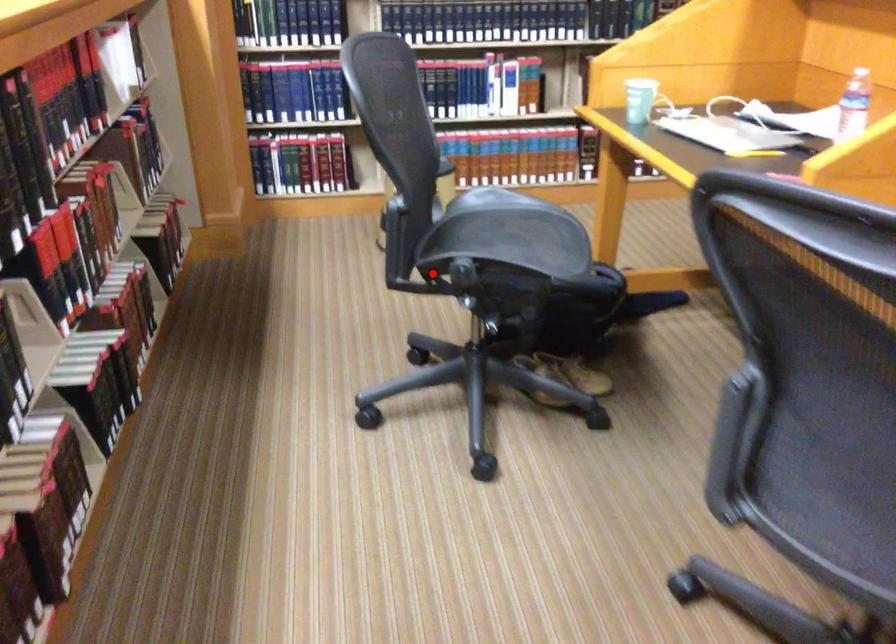
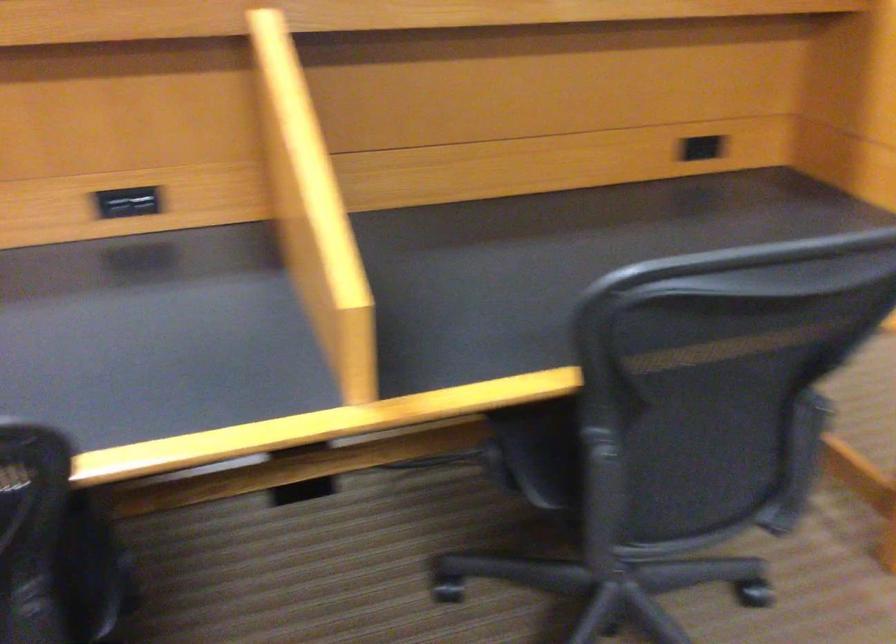
Question: I am providing you with two images of the same scene from different viewpoints. A red point is marked on the first image. Is the red point's position out of view in image 2?

Choices:
 (A) Yes
 (B) No

Answer: (A)